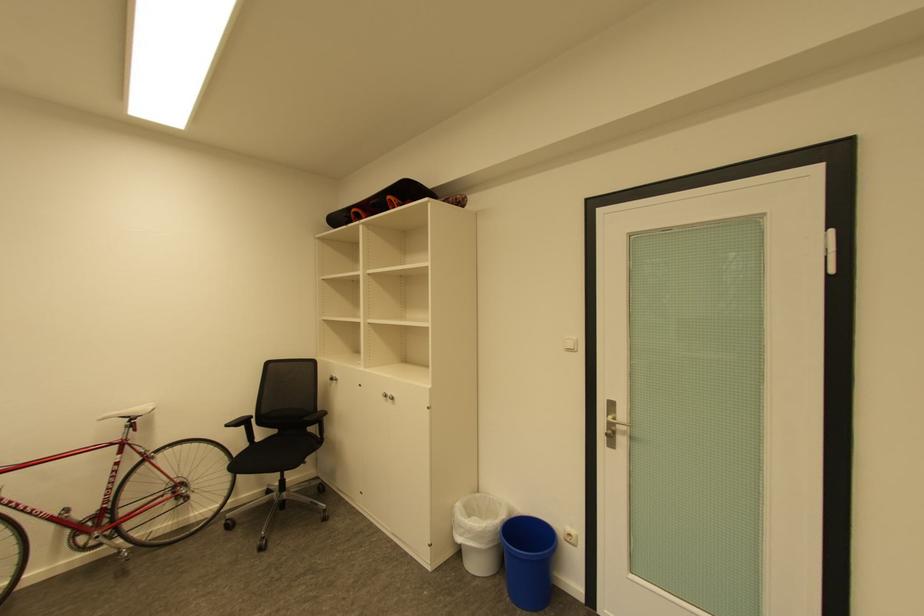
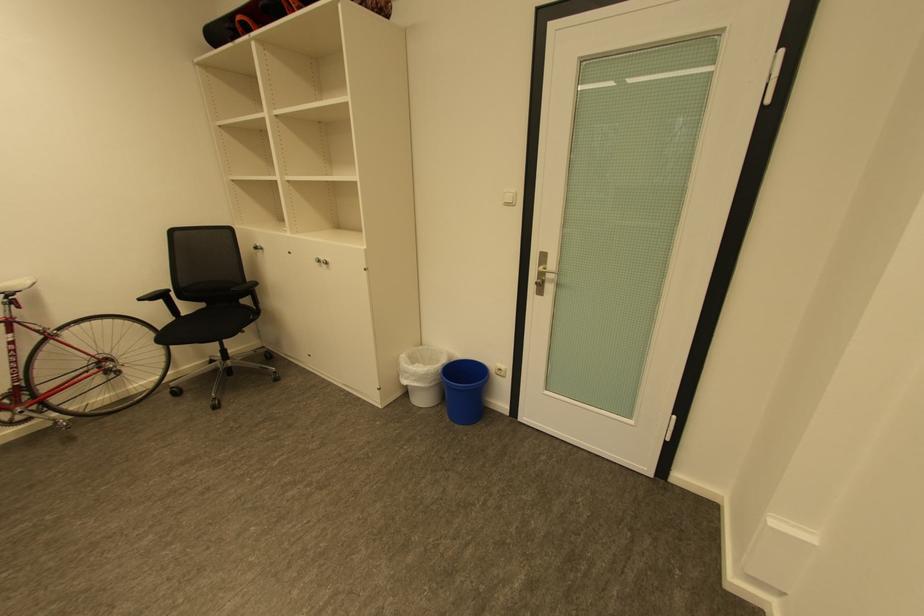
Find the pixel in the second image that matches point 264,440 in the first image.

(190, 315)